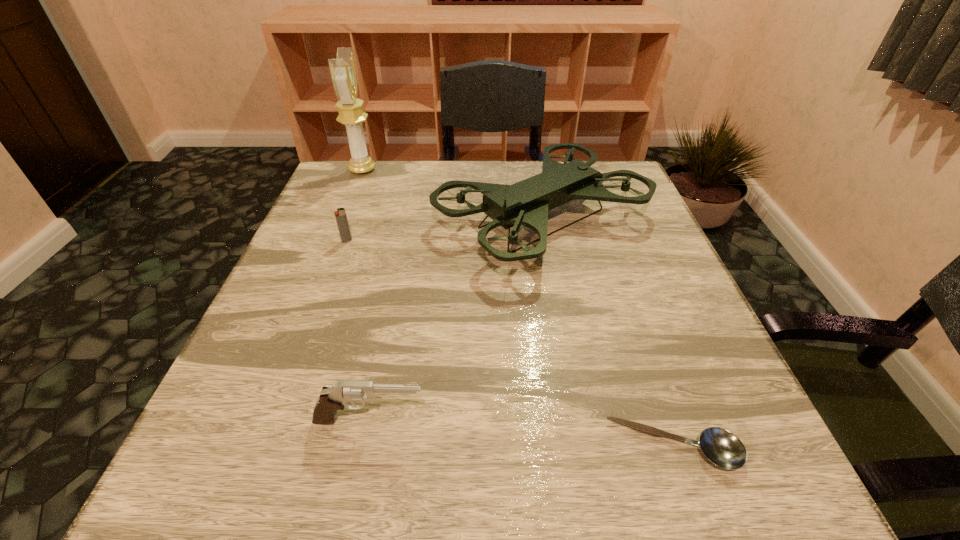
At what (x,y) coordinates should I click in order to perform the action: click on award that is positioned at the far edge. Please return your answer as a coordinate pair (x, y). This screenshot has height=540, width=960. Looking at the image, I should click on (342, 69).

Where is `drone present at the far edge`? The width and height of the screenshot is (960, 540). drone present at the far edge is located at coordinates (526, 203).

Where is `object that is at the near edge`? This screenshot has height=540, width=960. object that is at the near edge is located at coordinates (724, 449).

Where is `award at the left edge`? award at the left edge is located at coordinates (342, 69).

Identify the location of gun situated at the left edge. The width and height of the screenshot is (960, 540). (332, 398).

The height and width of the screenshot is (540, 960). What are the coordinates of `igniter located at the left edge` in the screenshot? It's located at (340, 215).

Locate an element on the screen. drone located in the right edge section of the desktop is located at coordinates (526, 203).

What are the coordinates of `ladle that is at the right edge` in the screenshot? It's located at (724, 449).

Image resolution: width=960 pixels, height=540 pixels. What are the coordinates of `object present at the far left corner` in the screenshot? It's located at (342, 69).

Image resolution: width=960 pixels, height=540 pixels. Find the location of `object positioned at the far right corner`. object positioned at the far right corner is located at coordinates (526, 203).